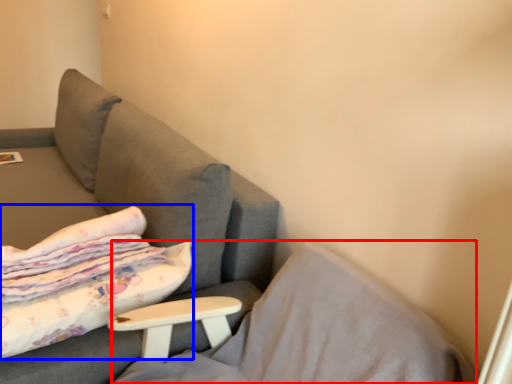
Question: Among these objects, which one is farthest to the camera, pillow (highlighted by a red box) or bed (highlighted by a blue box)?

Choices:
 (A) pillow
 (B) bed

Answer: (B)